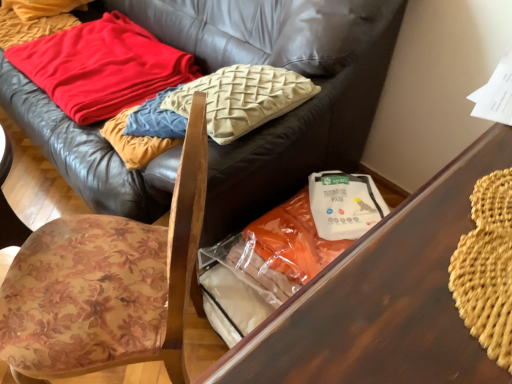
Question: Considering the positions of wooden table at center and leather couch at upper center in the image, is wooden table at center wider or thinner than leather couch at upper center?

Choices:
 (A) wide
 (B) thin

Answer: (B)

Question: Is wooden table at center taller or shorter than leather couch at upper center?

Choices:
 (A) short
 (B) tall

Answer: (B)

Question: Considering the real-world distances, which object is closest to the wooden table at center?

Choices:
 (A) floral fabric chair at left
 (B) leather couch at upper center
 (C) red soft fabric blanket at upper left

Answer: (A)

Question: Considering the real-world distances, which object is closest to the leather couch at upper center?

Choices:
 (A) floral fabric chair at left
 (B) red soft fabric blanket at upper left
 (C) wooden table at center

Answer: (B)